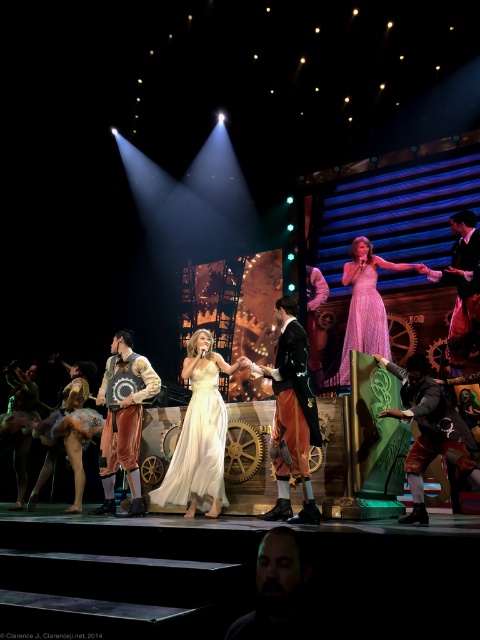
What are the coordinates of `white satin dress at center` in the screenshot? It's located at (199, 449).

Measure the distance between white satin dress at center and camera.

5.13 meters

This screenshot has width=480, height=640. What are the coordinates of `white satin dress at center` in the screenshot? It's located at (199, 449).

Where is `white satin dress at center`? The height and width of the screenshot is (640, 480). white satin dress at center is located at coordinates (199, 449).

What do you see at coordinates (429, 429) in the screenshot?
I see `leather jacket at center` at bounding box center [429, 429].

Is leather jacket at center smaller than velvet black coat at center?

Actually, leather jacket at center might be larger than velvet black coat at center.

Which is in front, point (412, 460) or point (279, 452)?

Positioned in front is point (412, 460).

Identify the location of leather jacket at center. (429, 429).

Does velvet black coat at center appear on the left side of pink satin dress at center?

Yes, velvet black coat at center is to the left of pink satin dress at center.

Can you confirm if velvet black coat at center is wider than pink satin dress at center?

Incorrect, velvet black coat at center's width does not surpass pink satin dress at center's.

You are a GUI agent. You are given a task and a screenshot of the screen. Output one action in this format:
    pyautogui.click(x=<x>, y=<y>)
    Task: Click on the velvet black coat at center
    This screenshot has width=480, height=640.
    Given the screenshot: What is the action you would take?
    pyautogui.click(x=292, y=404)

Where is `velvet black coat at center`? velvet black coat at center is located at coordinates (292, 404).